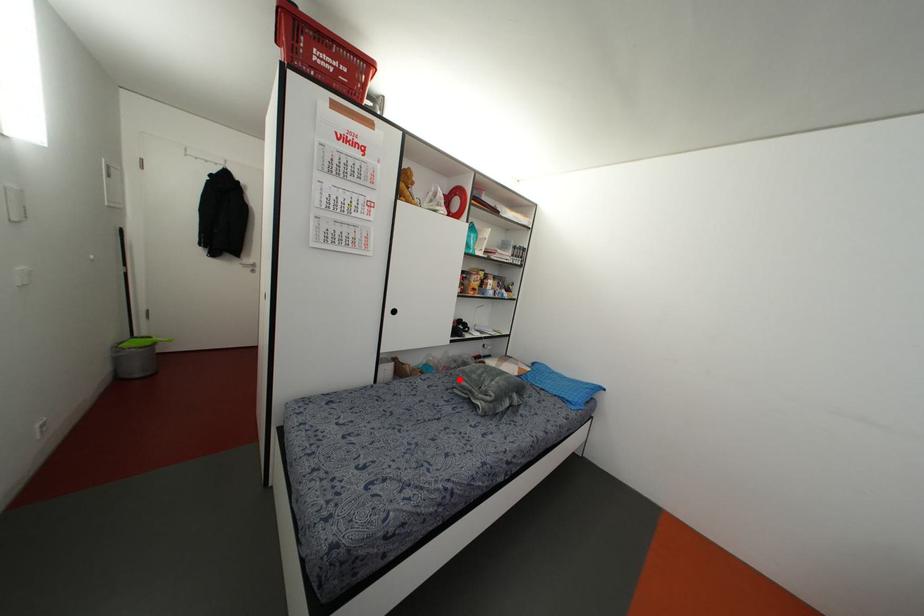
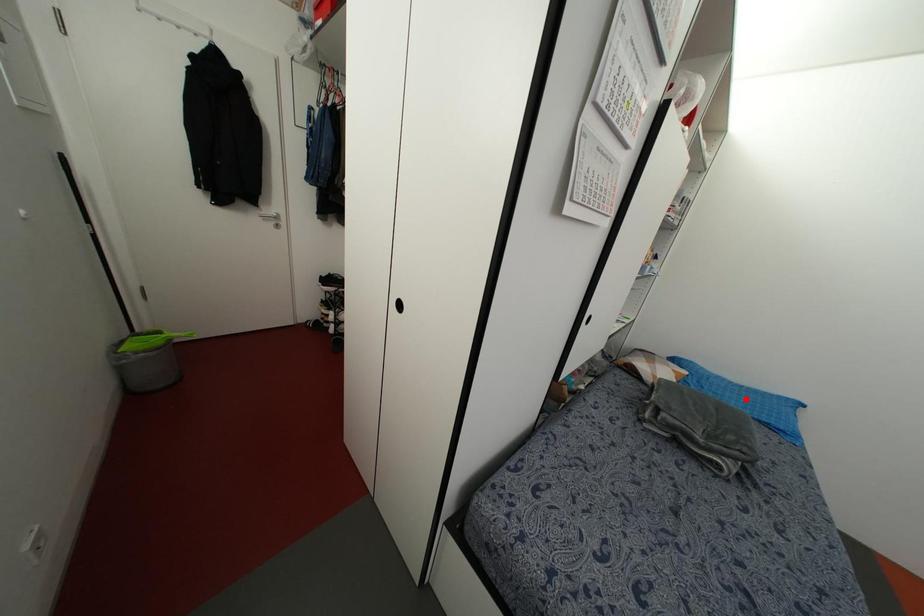
From the picture: I am providing you with two images of the same scene from different viewpoints. A red point is marked on the first image and another point is marked on the second image. Is the marked point in image1 the same physical position as the marked point in image2?

No